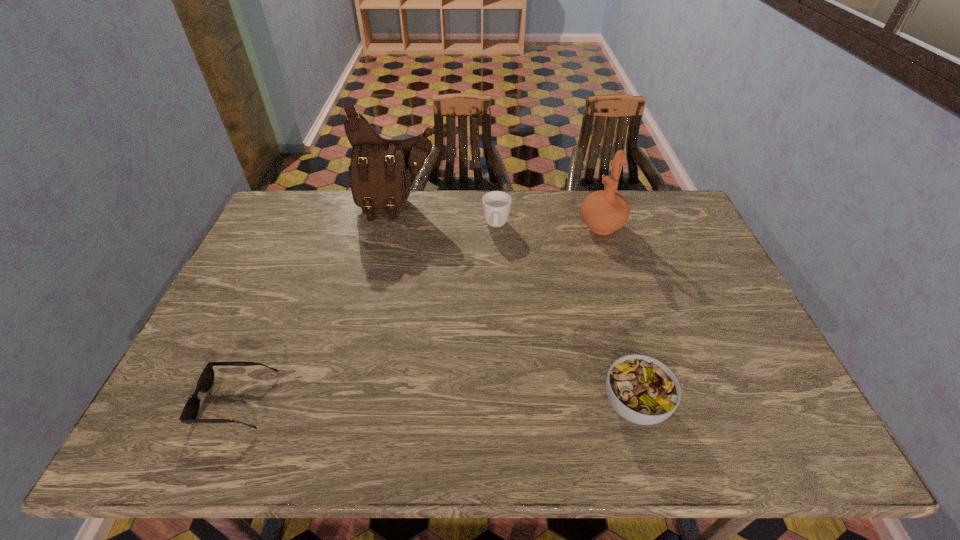
You are a GUI agent. You are given a task and a screenshot of the screen. Output one action in this format:
    pyautogui.click(x=<x>, y=<y>)
    Task: Click on the free spot on the desktop that is between the sunglasses and the soup bowl and is positioned with the handle on the side of the cup
    Image resolution: width=960 pixels, height=540 pixels.
    Given the screenshot: What is the action you would take?
    pyautogui.click(x=491, y=403)

I want to click on vacant space on the desktop that is between the sunglasses and the soup bowl and is positioned on the spout of the second tallest object, so 452,403.

Identify the location of free spot on the desktop that is between the shortest object and the soup bowl and is positioned on the front-facing side of the second object from left to right. Image resolution: width=960 pixels, height=540 pixels. (387, 402).